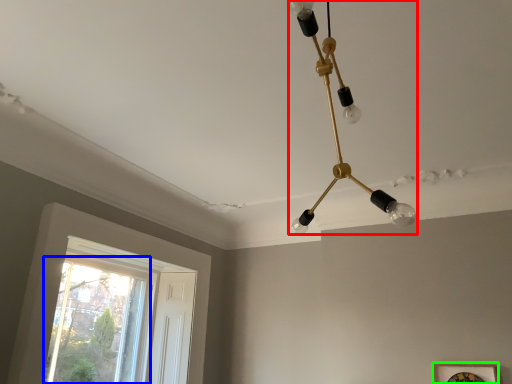
Question: Based on their relative distances, which object is nearer to lamp (highlighted by a red box)? Choose from window (highlighted by a blue box) and picture frame (highlighted by a green box).

Choices:
 (A) window
 (B) picture frame

Answer: (B)